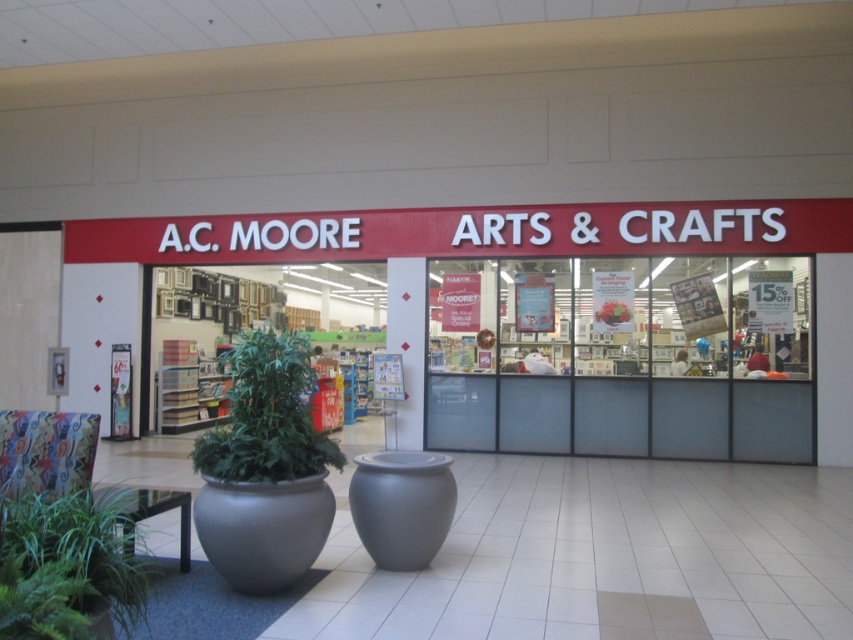
Question: Can you confirm if matte red sign at center is wider than green leafy plant at lower left?

Choices:
 (A) yes
 (B) no

Answer: (A)

Question: Which of the following is the farthest from the observer?

Choices:
 (A) (250, 416)
 (B) (4, 515)

Answer: (A)

Question: Which is farther from the green leafy plant at lower left?

Choices:
 (A) green leafy plant at center
 (B) matte red sign at center

Answer: (B)

Question: Is green leafy plant at lower left to the left of green leafy plant at center from the viewer's perspective?

Choices:
 (A) no
 (B) yes

Answer: (B)

Question: From the image, what is the correct spatial relationship of matte red sign at center in relation to green leafy plant at lower left?

Choices:
 (A) left
 (B) right

Answer: (B)

Question: Which of the following is the closest to the observer?

Choices:
 (A) (759, 403)
 (B) (10, 620)
 (C) (247, 412)

Answer: (B)